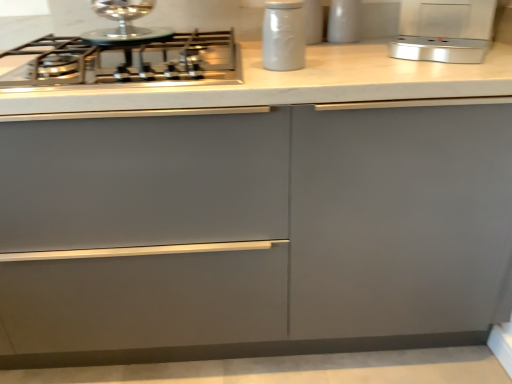
This screenshot has height=384, width=512. Describe the element at coordinates (123, 61) in the screenshot. I see `satin steel gas stove at upper left` at that location.

In order to click on satin silver toaster at upper right, the 3th kitchen appliance in the left-to-right sequence in this screenshot , I will do `click(444, 30)`.

Describe the element at coordinates (255, 232) in the screenshot. This screenshot has height=384, width=512. I see `matte gray cabinet at center` at that location.

At what (x,y) coordinates should I click in order to perform the action: click on white glossy jar at upper center, the 2th kitchen appliance positioned from the left. Please return your answer as a coordinate pair (x, y). The image size is (512, 384). Looking at the image, I should click on (344, 21).

From the image's perspective, is satin steel gas stove at upper left positioned above or below matte gray cabinet at center?

Based on their image positions, satin steel gas stove at upper left is located above matte gray cabinet at center.

Is satin steel gas stove at upper left directly adjacent to matte gray cabinet at center?

No.

Considering the positions of objects satin steel gas stove at upper left and matte gray cabinet at center in the image provided, who is more to the right, satin steel gas stove at upper left or matte gray cabinet at center?

Positioned to the right is matte gray cabinet at center.

Based on the photo, from a real-world perspective, which object rests below the other?

matte gray cabinet at center is physically lower.

From the picture: Would you say matte gray cabinet at center is to the left or to the right of white matte jar at upper center, marked as the 1th kitchen appliance in a left-to-right arrangement, in the picture?

In the image, matte gray cabinet at center appears on the left side of white matte jar at upper center, marked as the 1th kitchen appliance in a left-to-right arrangement.

Is point (301, 322) closer or farther from the camera than point (290, 7)?

Clearly, point (301, 322) is more distant from the camera than point (290, 7).

This screenshot has height=384, width=512. I want to click on cabinetry located below the white matte jar at upper center, which is counted as the third kitchen appliance, starting from the right (from the image's perspective), so click(x=255, y=232).

Which of these two, matte gray cabinet at center or white matte jar at upper center, marked as the 1th kitchen appliance in a left-to-right arrangement, stands taller?

matte gray cabinet at center.

Would you say satin steel gas stove at upper left is outside white glossy jar at upper center, the 2th kitchen appliance from the right?

Yes, satin steel gas stove at upper left is not within white glossy jar at upper center, the 2th kitchen appliance from the right.

Does point (33, 79) lie in front of point (341, 28)?

Yes, point (33, 79) is in front of point (341, 28).

How different are the orientations of satin steel gas stove at upper left and white glossy jar at upper center, the 2th kitchen appliance positioned from the left, in degrees?

There is a 0.000559-degree angle between the facing directions of satin steel gas stove at upper left and white glossy jar at upper center, the 2th kitchen appliance positioned from the left.

The width and height of the screenshot is (512, 384). I want to click on gas stove in front of the white glossy jar at upper center, the 2th kitchen appliance positioned from the left, so click(x=123, y=61).

Measure the distance from white matte jar at upper center, which is counted as the third kitchen appliance, starting from the right, to satin silver toaster at upper right, placed as the 1th kitchen appliance when sorted from right to left.

white matte jar at upper center, which is counted as the third kitchen appliance, starting from the right, is 14.09 inches away from satin silver toaster at upper right, placed as the 1th kitchen appliance when sorted from right to left.

Based on their positions, is white matte jar at upper center, which is counted as the third kitchen appliance, starting from the right, located to the left or right of satin silver toaster at upper right, the 3th kitchen appliance in the left-to-right sequence?

white matte jar at upper center, which is counted as the third kitchen appliance, starting from the right, is positioned on satin silver toaster at upper right, the 3th kitchen appliance in the left-to-right sequence,'s left side.

Considering the positions of objects white matte jar at upper center, which is counted as the third kitchen appliance, starting from the right, and satin silver toaster at upper right, the 3th kitchen appliance in the left-to-right sequence, in the image provided, who is in front, white matte jar at upper center, which is counted as the third kitchen appliance, starting from the right, or satin silver toaster at upper right, the 3th kitchen appliance in the left-to-right sequence,?

white matte jar at upper center, which is counted as the third kitchen appliance, starting from the right.

From a real-world perspective, is white matte jar at upper center, which is counted as the third kitchen appliance, starting from the right, under satin silver toaster at upper right, placed as the 1th kitchen appliance when sorted from right to left?

No, from a real-world perspective, white matte jar at upper center, which is counted as the third kitchen appliance, starting from the right, is not under satin silver toaster at upper right, placed as the 1th kitchen appliance when sorted from right to left.

Is white matte jar at upper center bigger or smaller than white matte jar at upper center, marked as the 1th kitchen appliance in a left-to-right arrangement?

Considering their sizes, white matte jar at upper center takes up less space than white matte jar at upper center, marked as the 1th kitchen appliance in a left-to-right arrangement.

From the picture: From a real-world perspective, who is located higher, white matte jar at upper center or white matte jar at upper center, marked as the 1th kitchen appliance in a left-to-right arrangement?

white matte jar at upper center, from a real-world perspective.

Is point (305, 15) closer or farther from the camera than point (270, 54)?

Clearly, point (305, 15) is more distant from the camera than point (270, 54).

Which object is more forward, white matte jar at upper center or white matte jar at upper center, which is counted as the third kitchen appliance, starting from the right?

white matte jar at upper center, which is counted as the third kitchen appliance, starting from the right, is closer to the camera.

Considering the relative positions of satin silver toaster at upper right, placed as the 1th kitchen appliance when sorted from right to left, and matte gray cabinet at center in the image provided, is satin silver toaster at upper right, placed as the 1th kitchen appliance when sorted from right to left, to the left or to the right of matte gray cabinet at center?

In the image, satin silver toaster at upper right, placed as the 1th kitchen appliance when sorted from right to left, appears on the right side of matte gray cabinet at center.

Is satin silver toaster at upper right, placed as the 1th kitchen appliance when sorted from right to left, aimed at matte gray cabinet at center?

Yes, satin silver toaster at upper right, placed as the 1th kitchen appliance when sorted from right to left, is turned towards matte gray cabinet at center.

Is satin silver toaster at upper right, placed as the 1th kitchen appliance when sorted from right to left, touching matte gray cabinet at center?

No, satin silver toaster at upper right, placed as the 1th kitchen appliance when sorted from right to left, is not touching matte gray cabinet at center.

Is satin steel gas stove at upper left next to white matte jar at upper center, marked as the 1th kitchen appliance in a left-to-right arrangement, and touching it?

No, satin steel gas stove at upper left is not with white matte jar at upper center, marked as the 1th kitchen appliance in a left-to-right arrangement.

From a real-world perspective, between satin steel gas stove at upper left and white matte jar at upper center, which is counted as the third kitchen appliance, starting from the right, who is vertically lower?

From a 3D spatial view, satin steel gas stove at upper left is below.

From the image's perspective, which one is positioned lower, satin steel gas stove at upper left or white matte jar at upper center, which is counted as the third kitchen appliance, starting from the right?

satin steel gas stove at upper left.

The width and height of the screenshot is (512, 384). Identify the location of gas stove to the left of matte gray cabinet at center. (123, 61).

Locate an element on the screen. The height and width of the screenshot is (384, 512). cabinetry that appears below the white matte jar at upper center, marked as the 1th kitchen appliance in a left-to-right arrangement (from a real-world perspective) is located at coordinates (255, 232).

Which object lies further to the anchor point matte gray cabinet at center, white matte jar at upper center, marked as the 1th kitchen appliance in a left-to-right arrangement, or white glossy jar at upper center, the 2th kitchen appliance from the right?

The object further to matte gray cabinet at center is white glossy jar at upper center, the 2th kitchen appliance from the right.

Based on their spatial positions, is satin silver toaster at upper right, the 3th kitchen appliance in the left-to-right sequence, or white glossy jar at upper center, the 2th kitchen appliance positioned from the left, further from white matte jar at upper center, which is counted as the third kitchen appliance, starting from the right?

Based on the image, white glossy jar at upper center, the 2th kitchen appliance positioned from the left, appears to be further to white matte jar at upper center, which is counted as the third kitchen appliance, starting from the right.

Considering their positions, is satin silver toaster at upper right, the 3th kitchen appliance in the left-to-right sequence, positioned closer to matte gray cabinet at center than satin steel gas stove at upper left?

satin steel gas stove at upper left lies closer to matte gray cabinet at center than the other object.

Estimate the real-world distances between objects in this image. Which object is closer to white matte jar at upper center, satin steel gas stove at upper left or matte gray cabinet at center?

satin steel gas stove at upper left is positioned closer to the anchor white matte jar at upper center.

When comparing their distances from white matte jar at upper center, does white glossy jar at upper center, the 2th kitchen appliance from the right, or satin steel gas stove at upper left seem closer?

white glossy jar at upper center, the 2th kitchen appliance from the right.

From the image, which object appears to be farther from white matte jar at upper center, marked as the 1th kitchen appliance in a left-to-right arrangement, matte gray cabinet at center or white matte jar at upper center?

matte gray cabinet at center lies further to white matte jar at upper center, marked as the 1th kitchen appliance in a left-to-right arrangement, than the other object.

Estimate the real-world distances between objects in this image. Which object is further from white matte jar at upper center, satin steel gas stove at upper left or satin silver toaster at upper right, the 3th kitchen appliance in the left-to-right sequence?

satin steel gas stove at upper left is positioned further to the anchor white matte jar at upper center.

Considering their positions, is white matte jar at upper center positioned closer to matte gray cabinet at center than white matte jar at upper center, marked as the 1th kitchen appliance in a left-to-right arrangement?

The object closer to matte gray cabinet at center is white matte jar at upper center, marked as the 1th kitchen appliance in a left-to-right arrangement.

I want to click on appliance situated between satin steel gas stove at upper left and white glossy jar at upper center, the 2th kitchen appliance positioned from the left, from left to right, so click(x=313, y=21).

You are a GUI agent. You are given a task and a screenshot of the screen. Output one action in this format:
    pyautogui.click(x=<x>, y=<y>)
    Task: Click on the cabinetry located between satin steel gas stove at upper left and white glossy jar at upper center, the 2th kitchen appliance from the right, in the left-right direction
    
    Given the screenshot: What is the action you would take?
    pyautogui.click(x=255, y=232)

The height and width of the screenshot is (384, 512). I want to click on appliance positioned between white matte jar at upper center, which is counted as the third kitchen appliance, starting from the right, and white glossy jar at upper center, the 2th kitchen appliance from the right, from near to far, so click(x=313, y=21).

Locate an element on the screen. This screenshot has height=384, width=512. kitchen appliance between satin steel gas stove at upper left and white glossy jar at upper center, the 2th kitchen appliance positioned from the left is located at coordinates (283, 35).